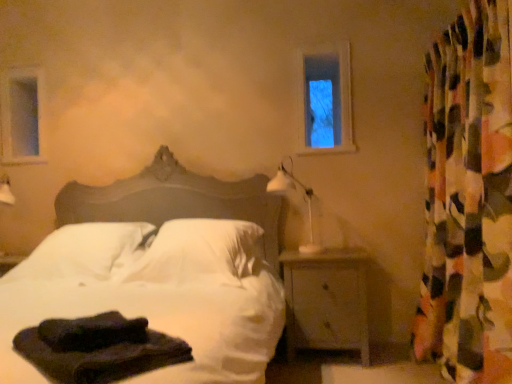
Question: Does white soft bed at center have a smaller size compared to white soft pillow at center, the 2th pillow positioned from the right?

Choices:
 (A) no
 (B) yes

Answer: (A)

Question: Is white soft bed at center outside white soft pillow at center, arranged as the 1th pillow when viewed from the left?

Choices:
 (A) yes
 (B) no

Answer: (A)

Question: Is white soft bed at center to the left of white soft pillow at center, the 2th pillow positioned from the right, from the viewer's perspective?

Choices:
 (A) yes
 (B) no

Answer: (B)

Question: Is white soft bed at center in contact with white soft pillow at center, the 2th pillow positioned from the right?

Choices:
 (A) yes
 (B) no

Answer: (B)

Question: Could you tell me if white soft bed at center is facing white soft pillow at center, arranged as the 1th pillow when viewed from the left?

Choices:
 (A) no
 (B) yes

Answer: (A)

Question: Is white soft bed at center wider than white soft pillow at center, arranged as the 1th pillow when viewed from the left?

Choices:
 (A) yes
 (B) no

Answer: (A)

Question: Is clear glass window at upper left, arranged as the first window frame when viewed from the back, smaller than clear glass window at upper center, acting as the second window frame starting from the back?

Choices:
 (A) no
 (B) yes

Answer: (B)

Question: From the image's perspective, does clear glass window at upper left, which appears as the 2th window frame when viewed from the right, appear higher than clear glass window at upper center, acting as the first window frame starting from the right?

Choices:
 (A) no
 (B) yes

Answer: (A)

Question: Considering the relative positions of clear glass window at upper left, marked as the second window frame in a front-to-back arrangement, and clear glass window at upper center, acting as the first window frame starting from the right, in the image provided, is clear glass window at upper left, marked as the second window frame in a front-to-back arrangement, in front of clear glass window at upper center, acting as the first window frame starting from the right,?

Choices:
 (A) no
 (B) yes

Answer: (A)

Question: Is clear glass window at upper left, which appears as the 2th window frame when viewed from the right, surrounding clear glass window at upper center, placed as the 2th window frame when sorted from left to right?

Choices:
 (A) yes
 (B) no

Answer: (B)

Question: Can you confirm if clear glass window at upper left, the 1th window frame viewed from the left, is thinner than clear glass window at upper center, acting as the second window frame starting from the back?

Choices:
 (A) no
 (B) yes

Answer: (B)

Question: Can you confirm if clear glass window at upper left, marked as the second window frame in a front-to-back arrangement, is wider than clear glass window at upper center, acting as the second window frame starting from the back?

Choices:
 (A) yes
 (B) no

Answer: (B)

Question: Is multicolored fabric curtain at right positioned in front of clear glass window at upper center, placed as the 2th window frame when sorted from left to right?

Choices:
 (A) no
 (B) yes

Answer: (B)